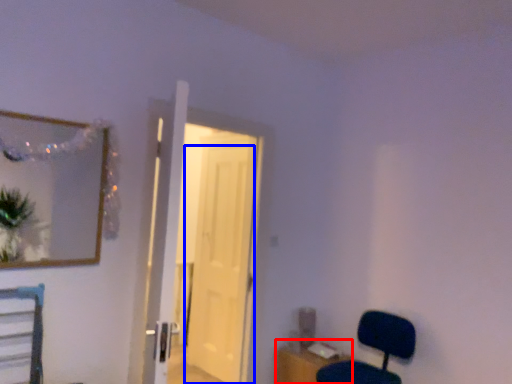
Question: Which of the following is the closest to the observer, table (highlighted by a red box) or door (highlighted by a blue box)?

Choices:
 (A) table
 (B) door

Answer: (A)